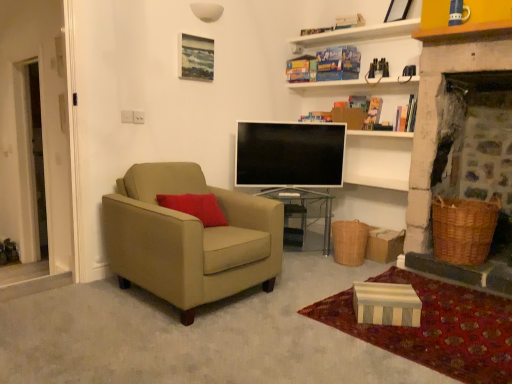
The height and width of the screenshot is (384, 512). I want to click on free space in front of woven brown picnic basket at lower center, which is the 2th picnic basket in right-to-left order, so click(x=347, y=269).